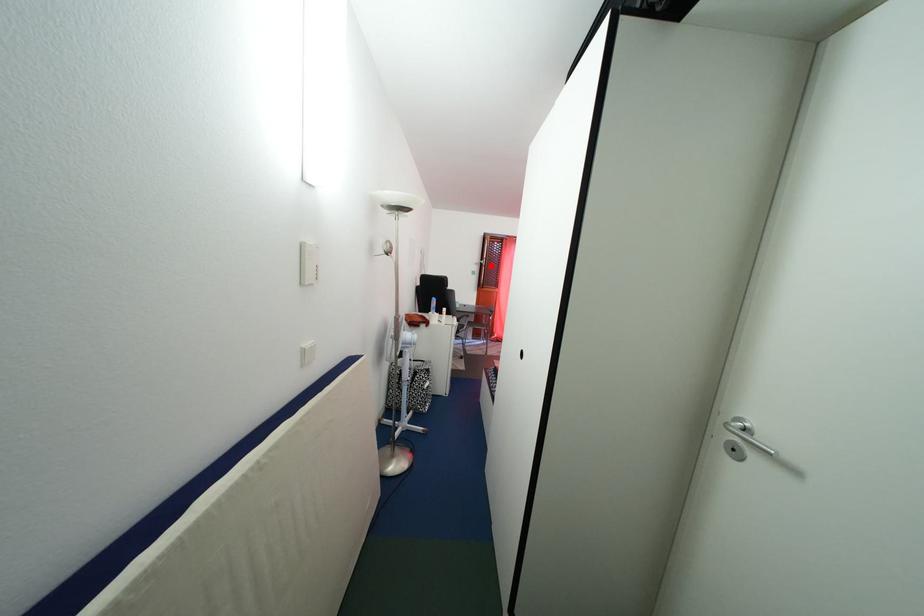
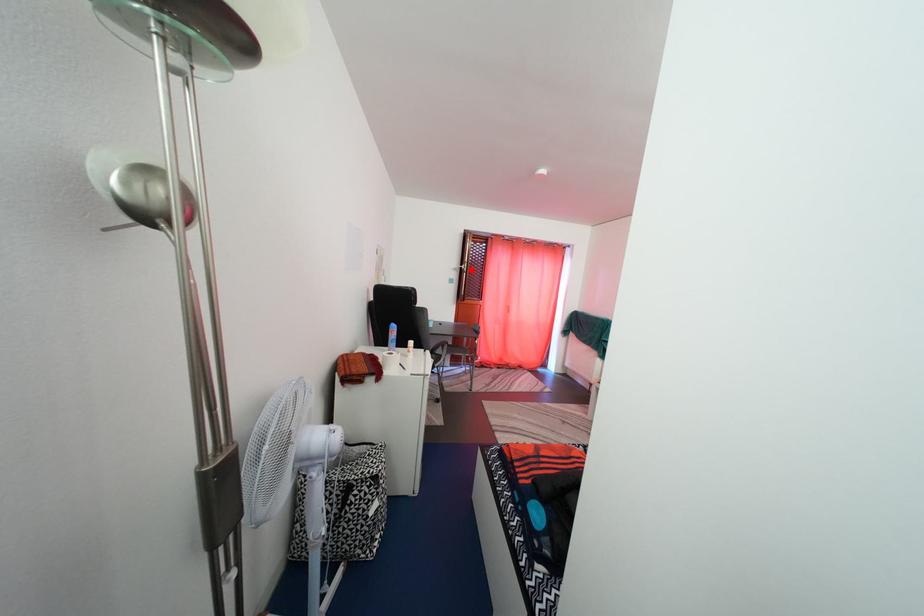
I am providing you with two images of the same scene from different viewpoints. A red point is marked on the first image and another point is marked on the second image. Do the highlighted points in image1 and image2 indicate the same real-world spot?

Yes